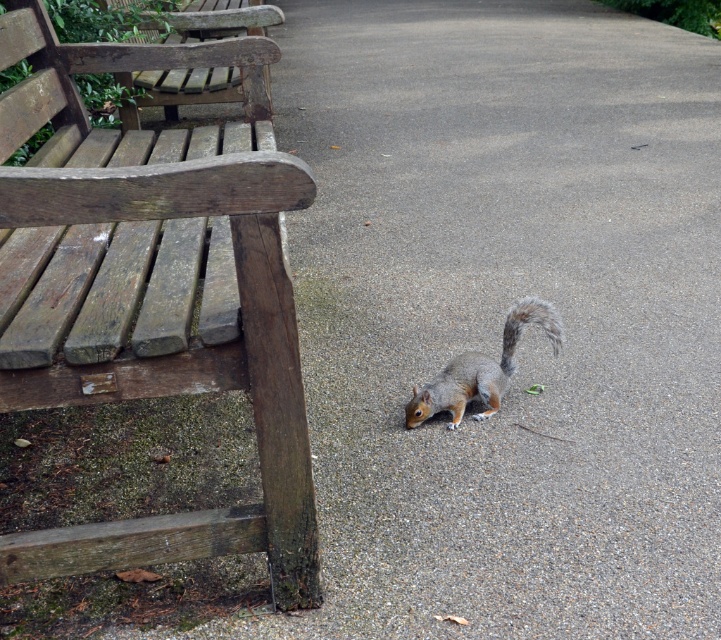
Question: Which point is closer to the camera?

Choices:
 (A) (516, 339)
 (B) (466, 390)

Answer: (B)

Question: Which point is farther to the camera?

Choices:
 (A) (180, 90)
 (B) (552, 328)
 (C) (314, 541)
 (D) (461, 355)

Answer: (A)

Question: Does weathered wood bench at upper left appear on the left side of gray-furred squirrel at lower center?

Choices:
 (A) yes
 (B) no

Answer: (A)

Question: Estimate the real-world distances between objects in this image. Which object is farther from the gray-furred squirrel at lower center?

Choices:
 (A) fuzzy gray tail at lower right
 (B) weathered wood bench at upper left
 (C) weathered wood bench at left

Answer: (B)

Question: Can you confirm if weathered wood bench at left is thinner than weathered wood bench at upper left?

Choices:
 (A) no
 (B) yes

Answer: (A)

Question: Can you confirm if weathered wood bench at left is positioned to the right of weathered wood bench at upper left?

Choices:
 (A) yes
 (B) no

Answer: (A)